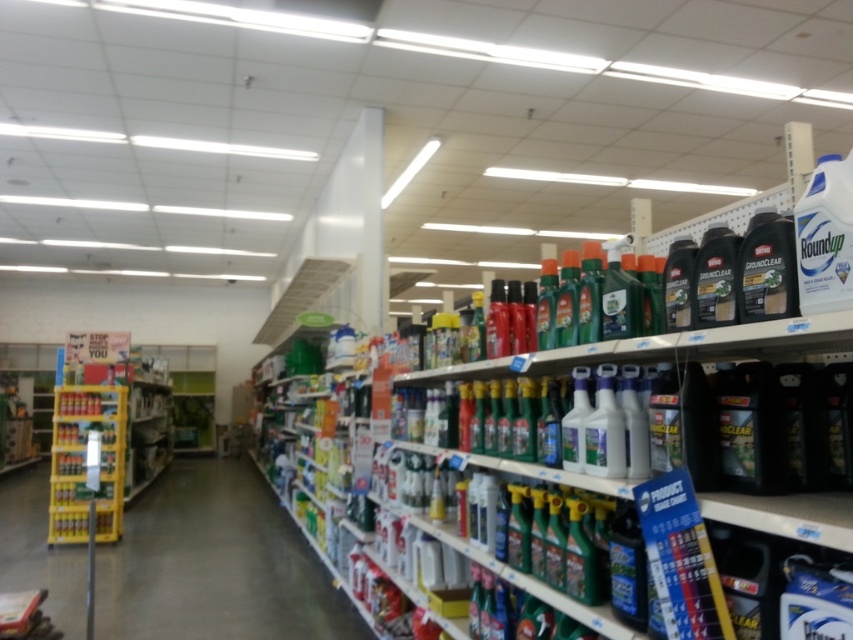
You are organizing the gardening section in the store. You have a green plastic bottles at center and a yellow plastic shelf at left. Which item is bigger in size?

The green plastic bottles at center has a larger size compared to the yellow plastic shelf at left.

Looking at this image, you are a customer looking for the green plastic bottles at center in the store. From your current position, which direction should you move to reach them while avoiding the yellow plastic shelf at left?

The green plastic bottles at center are in front of the yellow plastic shelf at left, so you should move forward towards the green plastic bottles at center to avoid the yellow plastic shelf at left.